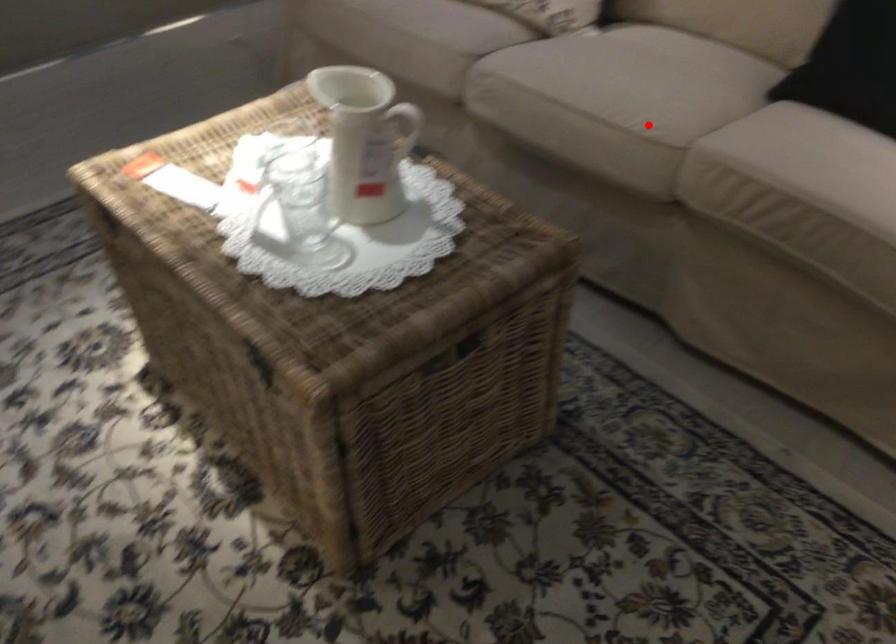
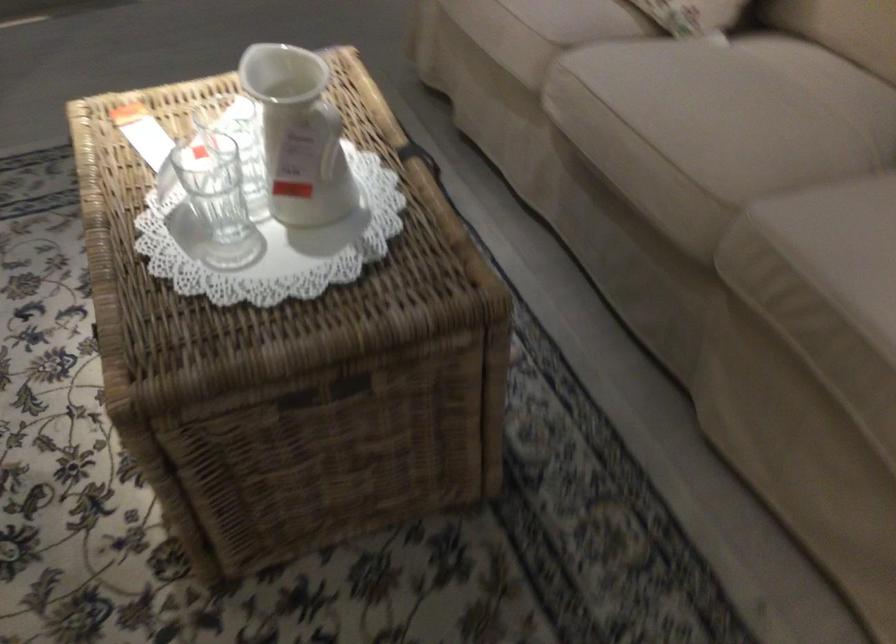
Locate, in the second image, the point that corresponds to the highlighted location in the first image.

(704, 167)